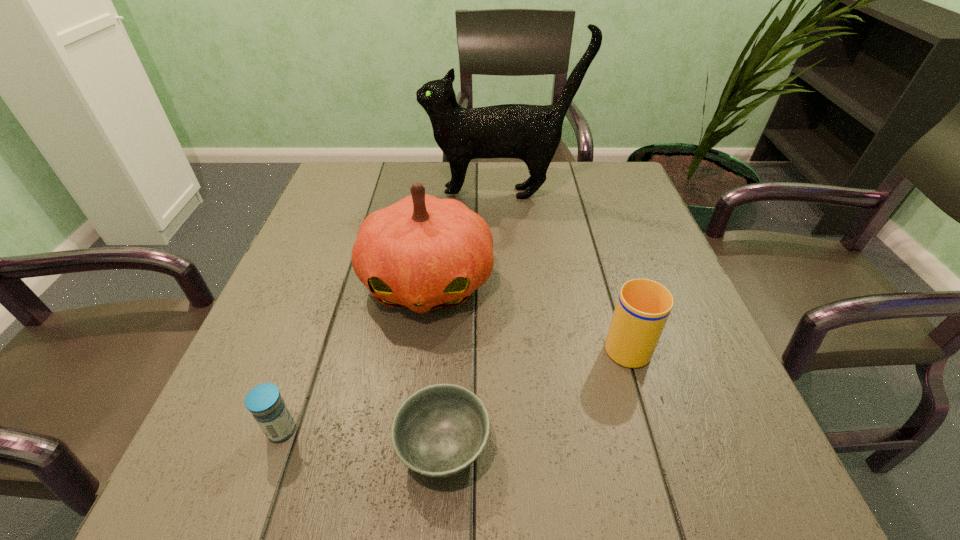
In order to click on free space between the fourth shortest object and the cup in this screenshot , I will do `click(526, 312)`.

Where is `vacant area between the bowl and the pumpkin`? vacant area between the bowl and the pumpkin is located at coordinates 435,364.

This screenshot has height=540, width=960. I want to click on free space between the third tallest object and the shortest object, so click(x=534, y=395).

This screenshot has width=960, height=540. I want to click on vacant space that's between the shortest object and the tallest object, so click(472, 320).

I want to click on free point between the cup and the shortest object, so click(534, 395).

At what (x,y) coordinates should I click in order to perform the action: click on free area in between the third tallest object and the shortest object. Please return your answer as a coordinate pair (x, y). Looking at the image, I should click on (534, 395).

Identify the location of unoccupied position between the shortest object and the tallest object. The height and width of the screenshot is (540, 960). (472, 320).

Identify the location of object that stands as the fourth closest to the shortest object. (532, 133).

I want to click on the second closest object to the farthest object, so click(643, 306).

The image size is (960, 540). I want to click on vacant region that satisfies the following two spatial constraints: 1. on the side of the cup with the handle; 2. on the face of the farthest object, so click(x=580, y=193).